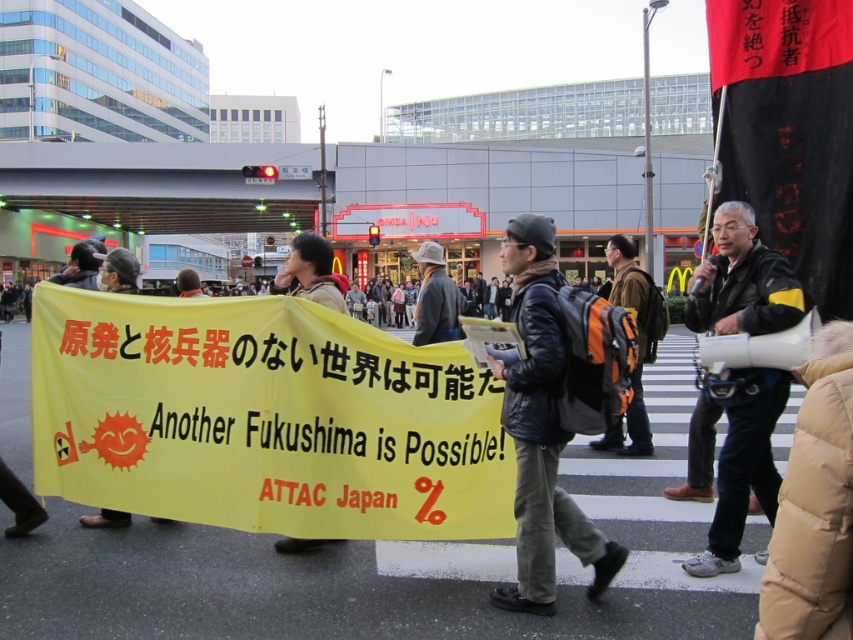
Question: Is black leather jacket at center smaller than yellow paper banner at center?

Choices:
 (A) yes
 (B) no

Answer: (A)

Question: Which object is the closest to the orange fabric backpack at center?

Choices:
 (A) dark blue leather jacket at center
 (B) yellow paper banner at center

Answer: (B)

Question: Which point is farther from the camera taking this photo?

Choices:
 (A) (634, 438)
 (B) (527, 548)

Answer: (A)

Question: Does orange fabric backpack at center lie in front of yellow paper banner at center?

Choices:
 (A) no
 (B) yes

Answer: (B)

Question: Can you confirm if black leather jacket at center is thinner than yellow paper banner at center?

Choices:
 (A) no
 (B) yes

Answer: (B)

Question: Which point is farther from the camera taking this photo?

Choices:
 (A) (563, 365)
 (B) (305, 548)
 (C) (761, 282)

Answer: (B)